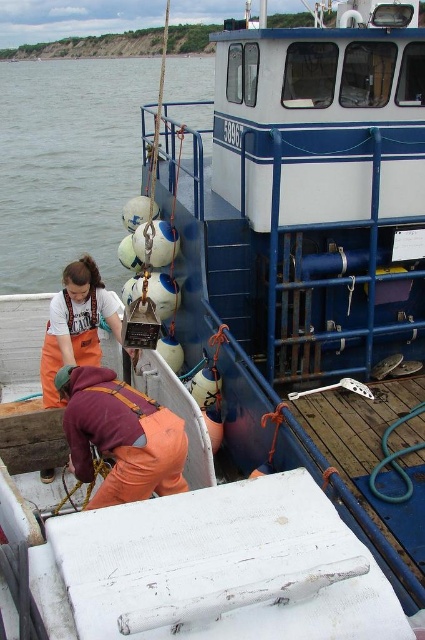
Based on the coordinates provided, what is the color and material of the object located at point (68, 164) on the boat deck?

The point (68, 164) corresponds to white matte water at left, which is part of the boat deck.

You are a sailor on the boat and need to know which object takes up more space in your view. Which is larger between the white matte water at left and the orange fabric at lower center?

The white matte water at left is larger in size compared to the orange fabric at lower center, so it takes up more space in your view.

You are standing on the deck of the boat and need to move from the orange fabric at lower center to the white matte water at left. The boat has a safety rule that requires maintaining a minimum distance of 40 feet from the water edge for safety. Is your current position compliant with this rule?

The distance between the white matte water at left and orange fabric at lower center is 38.52 feet, which is less than the required 40 feet. Therefore, moving from the orange fabric at lower center to the white matte water at left would not comply with the safety rule.